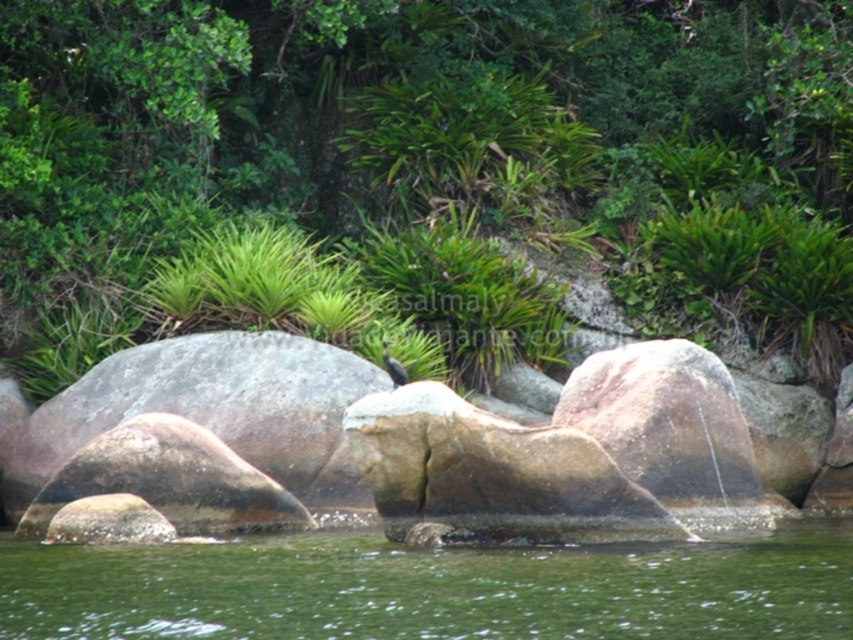
Does green leafy tree at upper left appear on the right side of green water at center?

No, green leafy tree at upper left is not to the right of green water at center.

Is point (202, 141) closer to camera compared to point (512, 556)?

No, (202, 141) is behind (512, 556).

The height and width of the screenshot is (640, 853). I want to click on green leafy tree at upper left, so click(x=432, y=163).